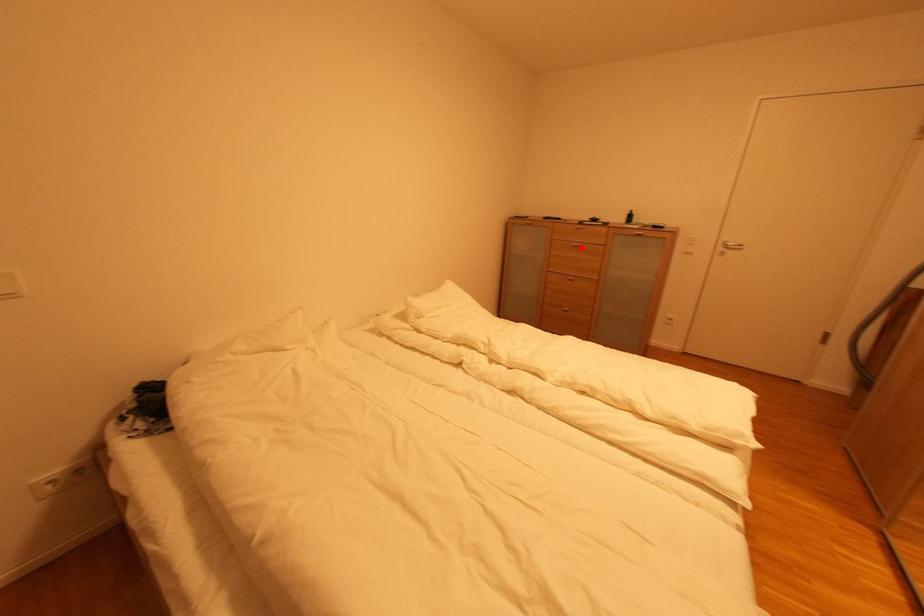
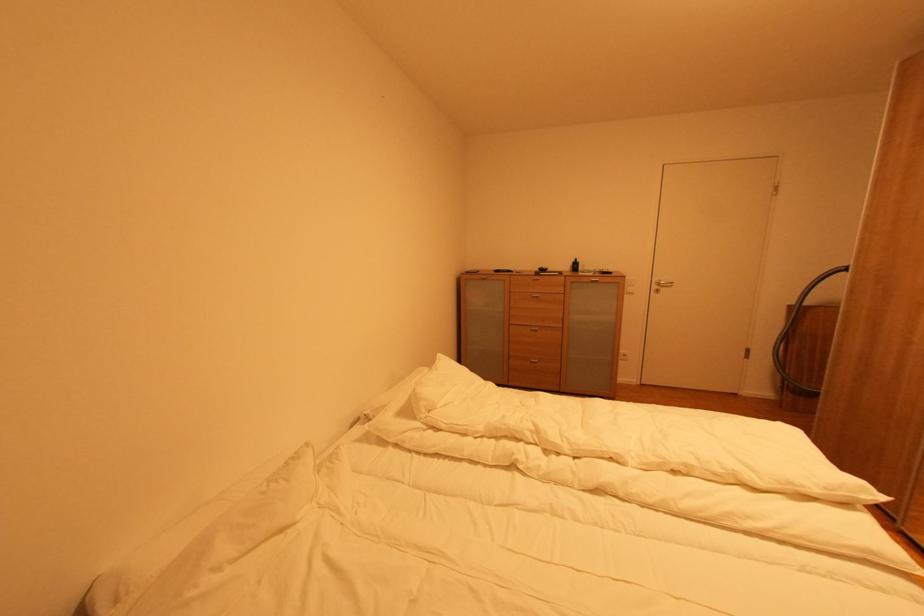
Question: I am providing you with two images of the same scene from different viewpoints. Image1 has a red point marked. In image2, the corresponding 3D location appears at what relative position? Reply with the corresponding letter.

Choices:
 (A) Closer
 (B) Farther

Answer: (B)